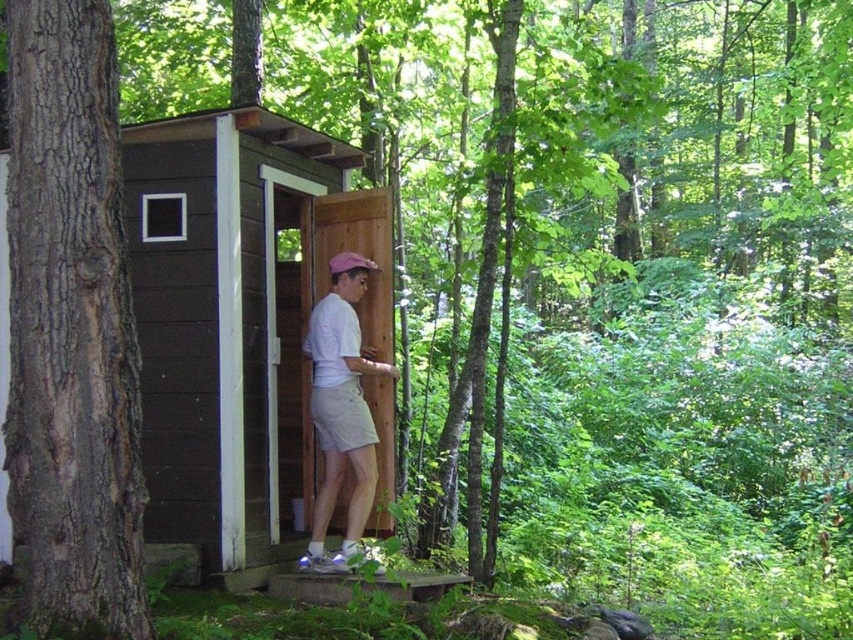
Between grayish-brown bark tree trunk at left and pink fabric baseball cap at center, which one is positioned lower?

grayish-brown bark tree trunk at left

Who is shorter, grayish-brown bark tree trunk at left or pink fabric baseball cap at center?

pink fabric baseball cap at center

Is point (96, 72) in front of point (368, 262)?

Yes, it is.

Locate an element on the screen. The image size is (853, 640). grayish-brown bark tree trunk at left is located at coordinates (71, 330).

Who is more distant from viewer, (x=209, y=266) or (x=39, y=451)?

Point (x=209, y=266)

Locate an element on the screen. Image resolution: width=853 pixels, height=640 pixels. brown wood cabin at center is located at coordinates (229, 321).

Locate an element on the screen. brown wood cabin at center is located at coordinates (229, 321).

Is brown wood cabin at center smaller than white matte shorts at center?

Actually, brown wood cabin at center might be larger than white matte shorts at center.

Between brown wood cabin at center and white matte shorts at center, which one appears on the right side from the viewer's perspective?

From the viewer's perspective, white matte shorts at center appears more on the right side.

Which is in front, point (183, 252) or point (341, 371)?

Point (183, 252) is more forward.

The image size is (853, 640). I want to click on brown wood cabin at center, so click(229, 321).